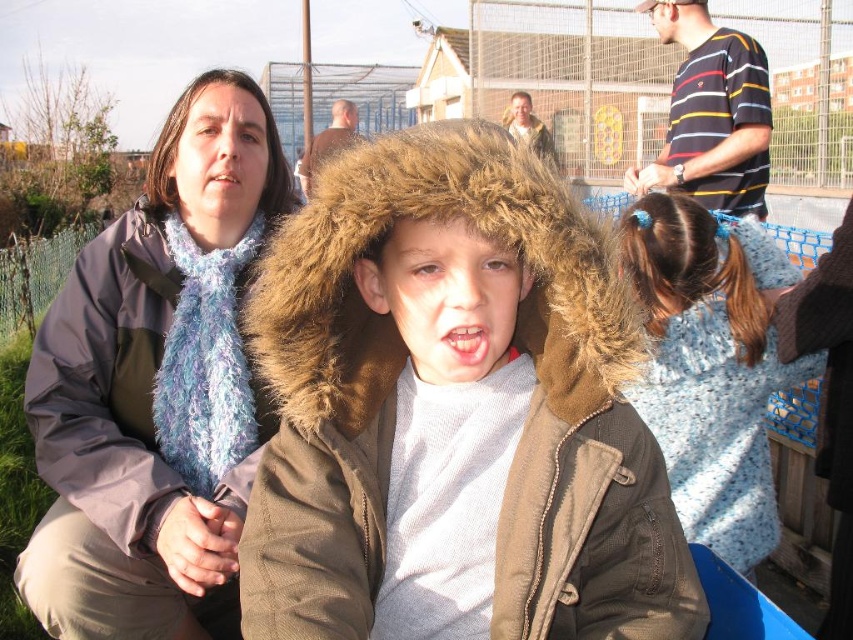
Is blue knitted sweater at right in front of striped cotton shirt at upper right?

Yes, it is.

Is blue knitted sweater at right above striped cotton shirt at upper right?

No, blue knitted sweater at right is not above striped cotton shirt at upper right.

Find the location of a particular element. blue knitted sweater at right is located at coordinates (711, 365).

Measure the distance between brown corduroy jacket at center and camera.

brown corduroy jacket at center is 3.40 feet from camera.

Between brown corduroy jacket at center and blue knitted sweater at right, which one appears on the left side from the viewer's perspective?

brown corduroy jacket at center

You are a GUI agent. You are given a task and a screenshot of the screen. Output one action in this format:
    pyautogui.click(x=<x>, y=<y>)
    Task: Click on the brown corduroy jacket at center
    This screenshot has height=640, width=853.
    Given the screenshot: What is the action you would take?
    pyautogui.click(x=454, y=412)

Identify the location of brown corduroy jacket at center. The height and width of the screenshot is (640, 853). (454, 412).

Who is taller, brown corduroy jacket at center or blue fuzzy scarf at left?

Standing taller between the two is blue fuzzy scarf at left.

Which is behind, point (459, 211) or point (91, 371)?

Positioned behind is point (91, 371).

Which is behind, point (369, 234) or point (238, 288)?

The point (238, 288) is behind.

Where is `brown corduroy jacket at center`? brown corduroy jacket at center is located at coordinates (454, 412).